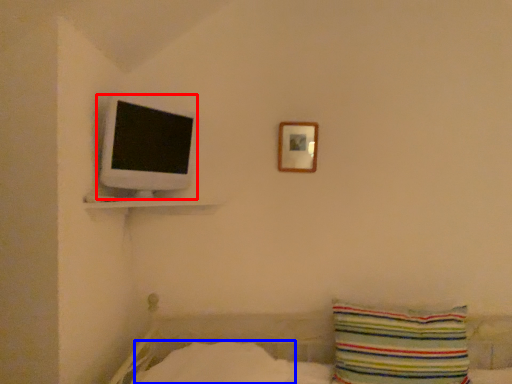
Question: Among these objects, which one is nearest to the camera, computer monitor (highlighted by a red box) or sheet (highlighted by a blue box)?

Choices:
 (A) computer monitor
 (B) sheet

Answer: (B)